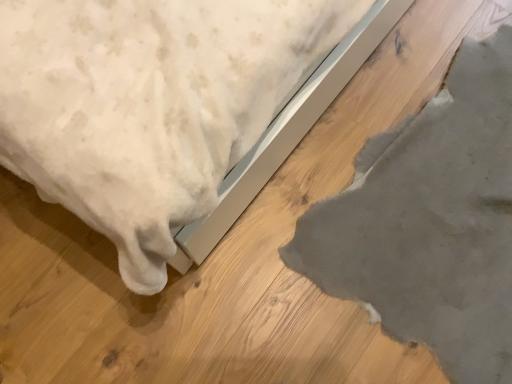
What are the coordinates of `gray matte rug at lower right` in the screenshot? It's located at (431, 222).

What do you see at coordinates (431, 222) in the screenshot? The image size is (512, 384). I see `gray matte rug at lower right` at bounding box center [431, 222].

Locate an element on the screen. Image resolution: width=512 pixels, height=384 pixels. gray matte rug at lower right is located at coordinates (431, 222).